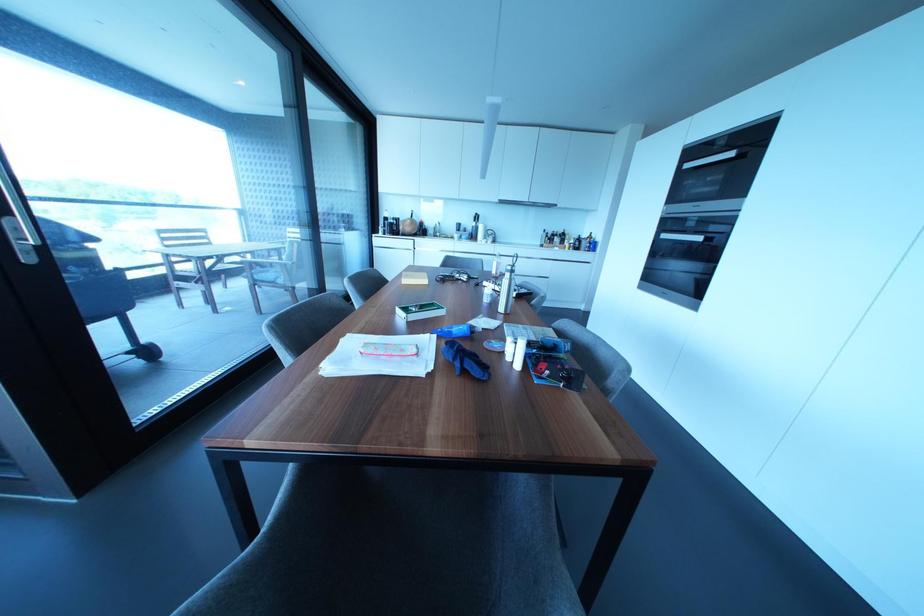
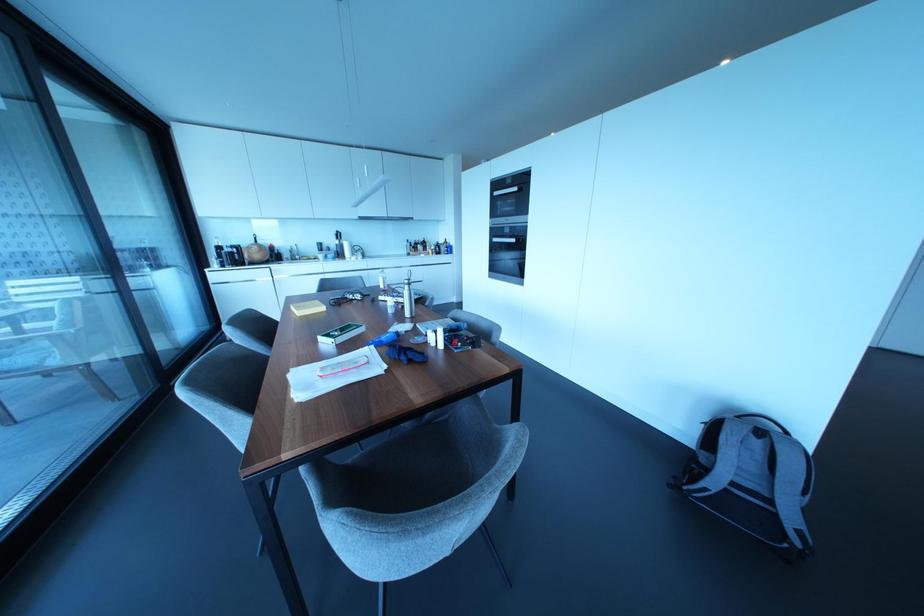
In the second image, find the point that corresponds to the point at 663,235 in the first image.

(493, 238)